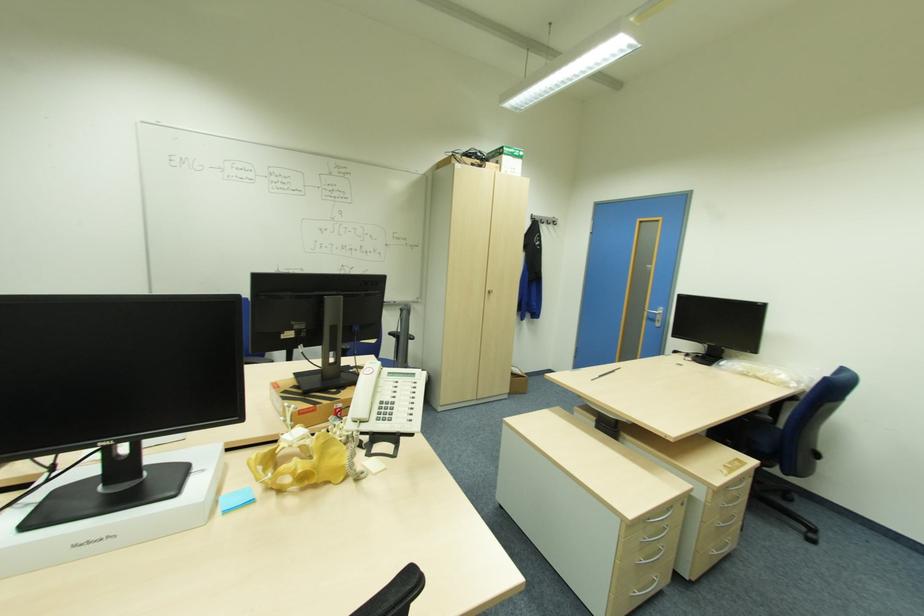
The image size is (924, 616). Find the location of `silver door handle`. silver door handle is located at coordinates (657, 315).